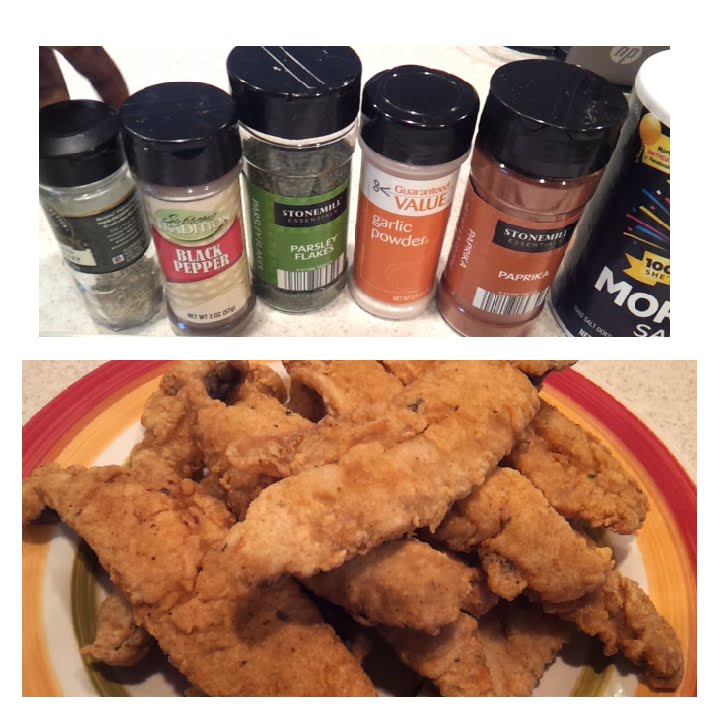
The width and height of the screenshot is (720, 720). Find the location of `black pepper spice container`. black pepper spice container is located at coordinates (206, 261).